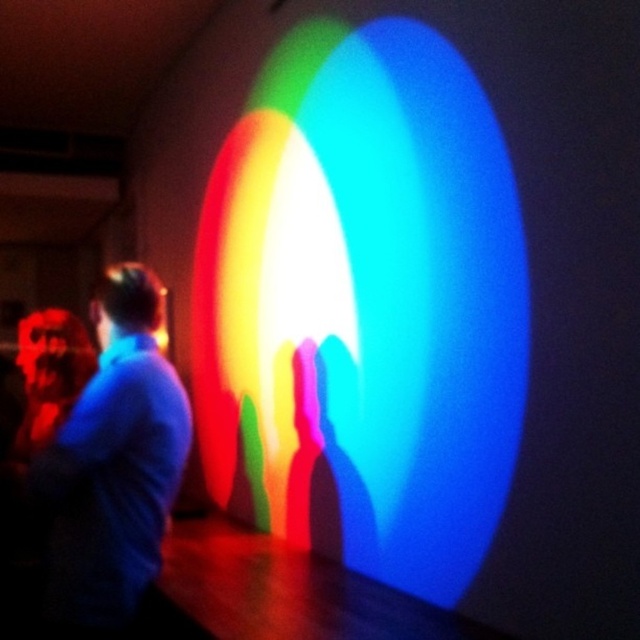
You are at an art exhibition and see the translucent rainbow light at center and the blue fabric shirt at left. Which object takes up more space in the image?

The translucent rainbow light at center takes up more space in the image because it is bigger than the blue fabric shirt at left.

You are at an art exhibition and see the translucent rainbow light at center and the blue fabric shirt at left. Which object is closer to you?

The translucent rainbow light at center is closer to you because the blue fabric shirt at left is behind it.